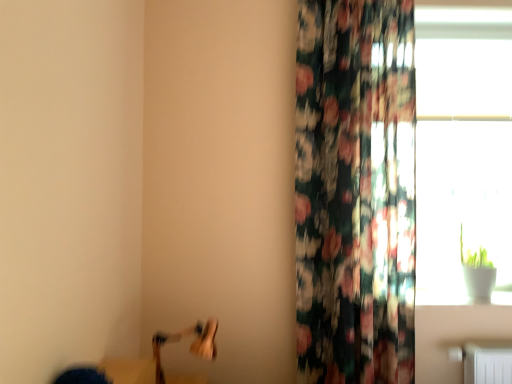
Question: Could you tell me if wooden swivel chair at lower left is facing transparent glass window at upper right?

Choices:
 (A) yes
 (B) no

Answer: (B)

Question: Considering the relative sizes of wooden swivel chair at lower left and transparent glass window at upper right in the image provided, is wooden swivel chair at lower left smaller than transparent glass window at upper right?

Choices:
 (A) no
 (B) yes

Answer: (B)

Question: Can you confirm if wooden swivel chair at lower left is taller than transparent glass window at upper right?

Choices:
 (A) yes
 (B) no

Answer: (B)

Question: Does wooden swivel chair at lower left contain transparent glass window at upper right?

Choices:
 (A) yes
 (B) no

Answer: (B)

Question: Is the position of wooden swivel chair at lower left more distant than that of transparent glass window at upper right?

Choices:
 (A) no
 (B) yes

Answer: (A)

Question: From a real-world perspective, relative to wooden swivel chair at lower left, is transparent glass window at upper right vertically above or below?

Choices:
 (A) below
 (B) above

Answer: (B)

Question: Considering the positions of point (471, 124) and point (167, 339), is point (471, 124) closer or farther from the camera than point (167, 339)?

Choices:
 (A) closer
 (B) farther

Answer: (B)

Question: Based on their sizes in the image, would you say transparent glass window at upper right is bigger or smaller than wooden swivel chair at lower left?

Choices:
 (A) small
 (B) big

Answer: (B)

Question: Is transparent glass window at upper right wider or thinner than wooden swivel chair at lower left?

Choices:
 (A) thin
 (B) wide

Answer: (A)

Question: Is floral fabric curtain at right taller or shorter than transparent glass window at upper right?

Choices:
 (A) tall
 (B) short

Answer: (A)

Question: Is floral fabric curtain at right wider or thinner than transparent glass window at upper right?

Choices:
 (A) wide
 (B) thin

Answer: (A)

Question: From a real-world perspective, is floral fabric curtain at right physically located above or below transparent glass window at upper right?

Choices:
 (A) below
 (B) above

Answer: (A)

Question: Is floral fabric curtain at right spatially inside transparent glass window at upper right, or outside of it?

Choices:
 (A) outside
 (B) inside

Answer: (A)

Question: Is floral fabric curtain at right bigger or smaller than wooden swivel chair at lower left?

Choices:
 (A) small
 (B) big

Answer: (B)

Question: Is floral fabric curtain at right wider or thinner than wooden swivel chair at lower left?

Choices:
 (A) thin
 (B) wide

Answer: (A)